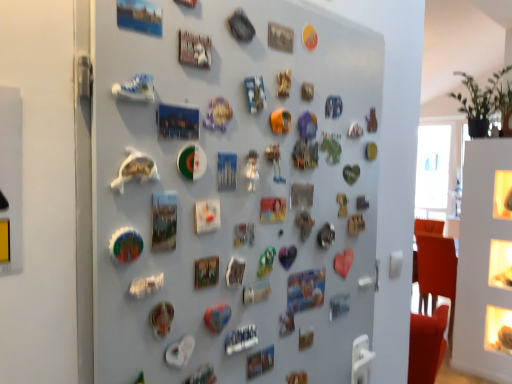
This screenshot has width=512, height=384. Describe the element at coordinates (498, 329) in the screenshot. I see `matte plastic button at center, the 3th button from the left` at that location.

This screenshot has width=512, height=384. Describe the element at coordinates (206, 272) in the screenshot. I see `green matte magnet at center, which is the 1th button in front-to-back order` at that location.

You are a GUI agent. You are given a task and a screenshot of the screen. Output one action in this format:
    pyautogui.click(x=<x>, y=<y>)
    Task: Click on the matte plastic button at center, the 1th button viewed from the right
    The height and width of the screenshot is (384, 512).
    Given the screenshot: What is the action you would take?
    pyautogui.click(x=498, y=329)

Is metallic silver button at upper center, which appears as the 2th button when viewed from the right, next to matte plastic button at center, the 3th button from the left, and touching it?

No, metallic silver button at upper center, which appears as the 2th button when viewed from the right, is not with matte plastic button at center, the 3th button from the left.

Locate an element on the screen. button that is the 1st one when counting forward from the matte plastic button at center, arranged as the first button when viewed from the back is located at coordinates (280, 37).

Between metallic silver button at upper center, placed as the second button when sorted from front to back, and matte plastic button at center, the third button when ordered from front to back, which one appears on the right side from the viewer's perspective?

From the viewer's perspective, matte plastic button at center, the third button when ordered from front to back, appears more on the right side.

Consider the image. Does metallic silver button at upper center, acting as the second button starting from the left, have a smaller size compared to matte plastic button at center, arranged as the first button when viewed from the back?

Correct, metallic silver button at upper center, acting as the second button starting from the left, occupies less space than matte plastic button at center, arranged as the first button when viewed from the back.

Consider the image. Which object is positioned more to the right, matte plastic button at center, arranged as the first button when viewed from the back, or metallic silver button at upper center, placed as the second button when sorted from front to back?

Positioned to the right is matte plastic button at center, arranged as the first button when viewed from the back.

Is matte plastic button at center, positioned as the first button in bottom-to-top order, wider or thinner than metallic silver button at upper center, acting as the 2th button starting from the back?

In the image, matte plastic button at center, positioned as the first button in bottom-to-top order, appears to be wider than metallic silver button at upper center, acting as the 2th button starting from the back.

Could you measure the distance between matte plastic button at center, positioned as the first button in bottom-to-top order, and metallic silver button at upper center, which appears as the 2th button when viewed from the right?

They are 3.23 meters apart.

Is matte plastic button at center, the 3th button from the left, in front of or behind metallic silver button at upper center, which appears as the 2th button when viewed from the right, in the image?

matte plastic button at center, the 3th button from the left, is positioned farther from the viewer than metallic silver button at upper center, which appears as the 2th button when viewed from the right.

Is green matte magnet at center, which is the 1th button in front-to-back order, directly adjacent to metallic silver button at upper center, the 1th button viewed from the top?

No, green matte magnet at center, which is the 1th button in front-to-back order, is not next to metallic silver button at upper center, the 1th button viewed from the top.

From a real-world perspective, is green matte magnet at center, which is the first button in left-to-right order, physically below metallic silver button at upper center, acting as the second button starting from the left?

Yes, from a real-world perspective, green matte magnet at center, which is the first button in left-to-right order, is below metallic silver button at upper center, acting as the second button starting from the left.

Considering the positions of objects green matte magnet at center, the 3th button from the right, and metallic silver button at upper center, which appears as the 2th button when viewed from the right, in the image provided, who is behind, green matte magnet at center, the 3th button from the right, or metallic silver button at upper center, which appears as the 2th button when viewed from the right,?

metallic silver button at upper center, which appears as the 2th button when viewed from the right, is behind.

In the image, there is a green matte magnet at center, the second button when ordered from top to bottom. At what (x,y) coordinates should I click in order to perform the action: click on button above it (from the image's perspective). Please return your answer as a coordinate pair (x, y). The image size is (512, 384). Looking at the image, I should click on (280, 37).

Looking at this image, is matte plastic button at center, positioned as the first button in bottom-to-top order, positioned in front of green matte magnet at center, which is the third button in back-to-front order?

No.

Is matte plastic button at center, the 3th button when ordered from top to bottom, bigger than green matte magnet at center, the 2th button positioned from the bottom?

Indeed, matte plastic button at center, the 3th button when ordered from top to bottom, has a larger size compared to green matte magnet at center, the 2th button positioned from the bottom.

Between matte plastic button at center, the 1th button viewed from the right, and green matte magnet at center, the second button when ordered from top to bottom, which one has more height?

matte plastic button at center, the 1th button viewed from the right.

Which point is more forward, (490, 335) or (212, 260)?

The point (212, 260) is in front.

From the image's perspective, between metallic fridge magnets at center and metallic silver button at upper center, the 1th button viewed from the top, which one is located above?

metallic silver button at upper center, the 1th button viewed from the top.

Considering the sizes of objects metallic fridge magnets at center and metallic silver button at upper center, the 1th button viewed from the top, in the image provided, who is smaller, metallic fridge magnets at center or metallic silver button at upper center, the 1th button viewed from the top,?

With smaller size is metallic silver button at upper center, the 1th button viewed from the top.

Is metallic fridge magnets at center next to metallic silver button at upper center, placed as the second button when sorted from front to back?

No, metallic fridge magnets at center is not in contact with metallic silver button at upper center, placed as the second button when sorted from front to back.

Is metallic fridge magnets at center oriented towards metallic silver button at upper center, the 1th button viewed from the top?

Yes, metallic fridge magnets at center is facing metallic silver button at upper center, the 1th button viewed from the top.

Based on their sizes in the image, would you say green matte magnet at center, the 2th button positioned from the bottom, is bigger or smaller than metallic fridge magnets at center?

In the image, green matte magnet at center, the 2th button positioned from the bottom, appears to be smaller than metallic fridge magnets at center.

Which point is more forward, (x=195, y=273) or (x=367, y=289)?

Point (x=195, y=273)

Which is behind, green matte magnet at center, the 2th button positioned from the bottom, or metallic fridge magnets at center?

Positioned behind is green matte magnet at center, the 2th button positioned from the bottom.

From a real-world perspective, relative to metallic fridge magnets at center, is green matte magnet at center, which is the first button in left-to-right order, vertically above or below?

green matte magnet at center, which is the first button in left-to-right order, is situated lower than metallic fridge magnets at center in the real world.

Is point (285, 47) in front of point (295, 23)?

Yes, it is in front of point (295, 23).

Considering the sizes of metallic silver button at upper center, acting as the second button starting from the left, and metallic fridge magnets at center in the image, is metallic silver button at upper center, acting as the second button starting from the left, bigger or smaller than metallic fridge magnets at center?

metallic silver button at upper center, acting as the second button starting from the left, is smaller than metallic fridge magnets at center.

Which is more to the left, metallic silver button at upper center, which appears as the 2th button when viewed from the right, or metallic fridge magnets at center?

Positioned to the left is metallic fridge magnets at center.

From the image's perspective, starting from the metallic silver button at upper center, the 1th button viewed from the top, which button is the 2nd one below? Please provide its 2D coordinates.

[(498, 329)]

Which button is the 1st one when counting from the left side of the matte plastic button at center, the 3th button when ordered from top to bottom? Please provide its 2D coordinates.

[(280, 37)]

Looking at the image, which one is located closer to metallic fridge magnets at center, matte plastic button at center, the 3th button when ordered from top to bottom, or green matte magnet at center, the 2th button positioned from the bottom?

green matte magnet at center, the 2th button positioned from the bottom, is closer to metallic fridge magnets at center.

Considering their positions, is metallic fridge magnets at center positioned further to matte plastic button at center, arranged as the first button when viewed from the back, than metallic silver button at upper center, the 1th button viewed from the top?

metallic silver button at upper center, the 1th button viewed from the top, is positioned further to the anchor matte plastic button at center, arranged as the first button when viewed from the back.

Considering their positions, is green matte magnet at center, which is the 1th button in front-to-back order, positioned closer to metallic silver button at upper center, acting as the 2th button starting from the back, than matte plastic button at center, the third button when ordered from front to back?

Based on the image, green matte magnet at center, which is the 1th button in front-to-back order, appears to be nearer to metallic silver button at upper center, acting as the 2th button starting from the back.

Estimate the real-world distances between objects in this image. Which object is closer to matte plastic button at center, the third button when ordered from front to back, green matte magnet at center, the 3th button from the right, or metallic silver button at upper center, the 3th button ordered from the bottom?

green matte magnet at center, the 3th button from the right, lies closer to matte plastic button at center, the third button when ordered from front to back, than the other object.

From the picture: Looking at the image, which one is located further to metallic silver button at upper center, the 3th button ordered from the bottom, metallic fridge magnets at center or green matte magnet at center, which is the third button in back-to-front order?

green matte magnet at center, which is the third button in back-to-front order, is further to metallic silver button at upper center, the 3th button ordered from the bottom.

Which object lies nearer to the anchor point green matte magnet at center, which is the 1th button in front-to-back order, metallic silver button at upper center, the 3th button ordered from the bottom, or metallic fridge magnets at center?

The object closer to green matte magnet at center, which is the 1th button in front-to-back order, is metallic fridge magnets at center.

Looking at the image, which one is located further to metallic fridge magnets at center, matte plastic button at center, the third button when ordered from front to back, or metallic silver button at upper center, which appears as the 2th button when viewed from the right?

matte plastic button at center, the third button when ordered from front to back, is positioned further to the anchor metallic fridge magnets at center.

Considering their positions, is green matte magnet at center, which is the third button in back-to-front order, positioned closer to metallic fridge magnets at center than metallic silver button at upper center, which appears as the 2th button when viewed from the right?

green matte magnet at center, which is the third button in back-to-front order, lies closer to metallic fridge magnets at center than the other object.

Image resolution: width=512 pixels, height=384 pixels. What are the coordinates of `fireplace between metallic silver button at upper center, the 3th button ordered from the bottom, and green matte magnet at center, which is the first button in left-to-right order, from top to bottom` in the screenshot? It's located at (233, 194).

Identify the location of button between green matte magnet at center, which is the first button in left-to-right order, and matte plastic button at center, the third button when ordered from front to back, along the z-axis. (280, 37).